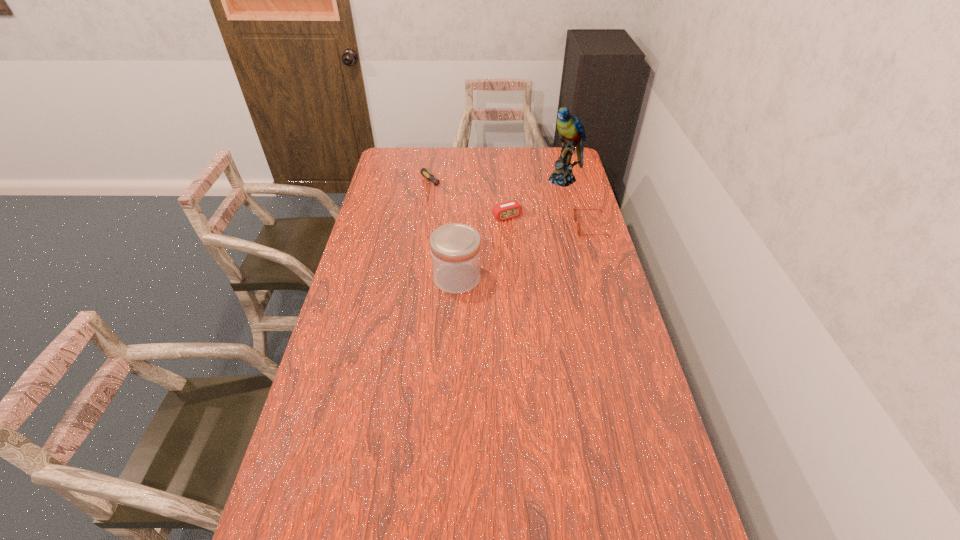
What are the coordinates of `object that is the second nearest to the third object from right to left` in the screenshot? It's located at (575, 210).

Where is `free location that satisfies the following two spatial constraints: 1. on the back side of the fourth shortest object; 2. on the face of the sunglasses`? This screenshot has width=960, height=540. free location that satisfies the following two spatial constraints: 1. on the back side of the fourth shortest object; 2. on the face of the sunglasses is located at coordinates (460, 227).

Find the location of a particular element. vacant space that satisfies the following two spatial constraints: 1. on the back side of the tallest object; 2. on the left side of the jar is located at coordinates (463, 180).

The height and width of the screenshot is (540, 960). In order to click on free space that satisfies the following two spatial constraints: 1. on the front side of the second shortest object; 2. on the face of the alarm clock in this screenshot , I will do `click(508, 227)`.